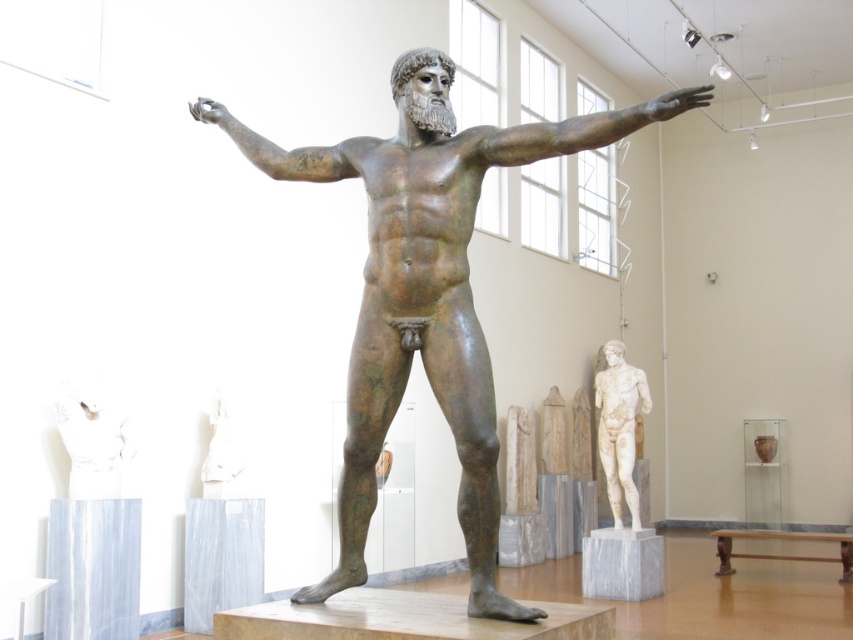
Question: Which point appears closest to the camera in this image?

Choices:
 (A) (59, 404)
 (B) (258, 150)
 (C) (611, 493)

Answer: (B)

Question: Which point appears closest to the camera in this image?

Choices:
 (A) (630, 508)
 (B) (537, 131)
 (C) (370, 150)
 (D) (70, 442)

Answer: (B)

Question: Can you confirm if white marble torso at center is thinner than bronze/textured arm at center?

Choices:
 (A) no
 (B) yes

Answer: (B)

Question: Which of the following is the farthest from the observer?

Choices:
 (A) (479, 390)
 (B) (73, 381)
 (C) (650, 113)

Answer: (B)

Question: Does white marble torso at center have a larger size compared to bronze/textured arm at center?

Choices:
 (A) yes
 (B) no

Answer: (B)

Question: Does white marble torso at center have a larger size compared to bronze/textured arm at center?

Choices:
 (A) no
 (B) yes

Answer: (A)